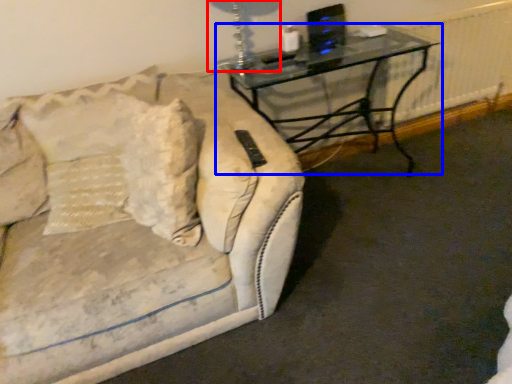
Question: Which object is closer to the camera taking this photo, table lamp (highlighted by a red box) or table (highlighted by a blue box)?

Choices:
 (A) table lamp
 (B) table

Answer: (A)